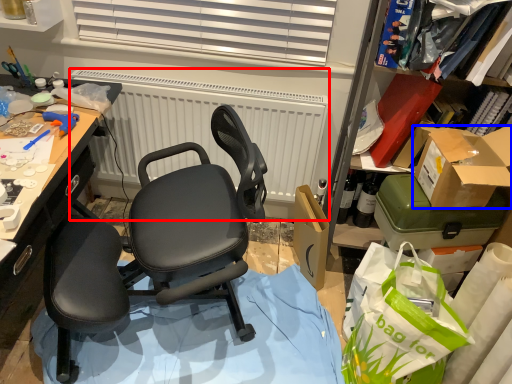
Question: Which object is closer to the camera taking this photo, radiator (highlighted by a red box) or box (highlighted by a blue box)?

Choices:
 (A) radiator
 (B) box

Answer: (B)